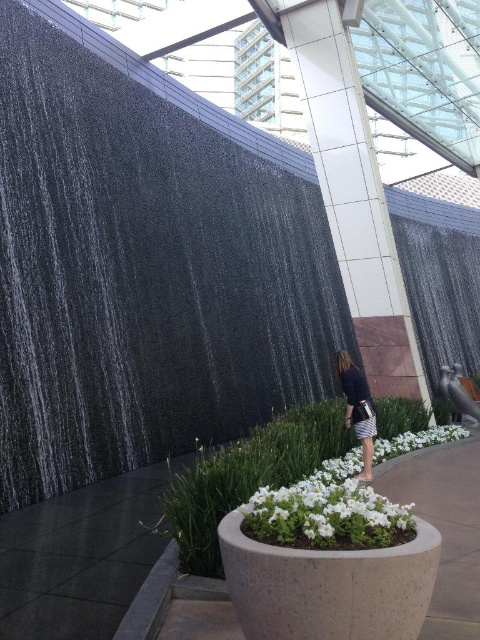
Can you confirm if white textured plant at center is wider than white matte flower pot at center?

Correct, the width of white textured plant at center exceeds that of white matte flower pot at center.

The height and width of the screenshot is (640, 480). What do you see at coordinates (245, 476) in the screenshot? I see `white textured plant at center` at bounding box center [245, 476].

You are a GUI agent. You are given a task and a screenshot of the screen. Output one action in this format:
    pyautogui.click(x=<x>, y=<y>)
    Task: Click on the white textured plant at center
    The image size is (480, 640).
    Given the screenshot: What is the action you would take?
    pyautogui.click(x=245, y=476)

Between white matte flower pot at center and dark blue fabric dress at center, which one is positioned higher?

dark blue fabric dress at center

Who is more distant from viewer, [443,432] or [344,387]?

Point [443,432]

Locate an element on the screen. This screenshot has height=640, width=480. white matte flower pot at center is located at coordinates (326, 512).

From the picture: Measure the distance between point (74, 330) and camera.

Point (74, 330) and camera are 7.45 meters apart.

Does black granite waterfall at left appear over white matte flower pot at center?

Yes, black granite waterfall at left is above white matte flower pot at center.

You are a GUI agent. You are given a task and a screenshot of the screen. Output one action in this format:
    pyautogui.click(x=<x>, y=<y>)
    Task: Click on the black granite waterfall at left
    
    Given the screenshot: What is the action you would take?
    pyautogui.click(x=143, y=273)